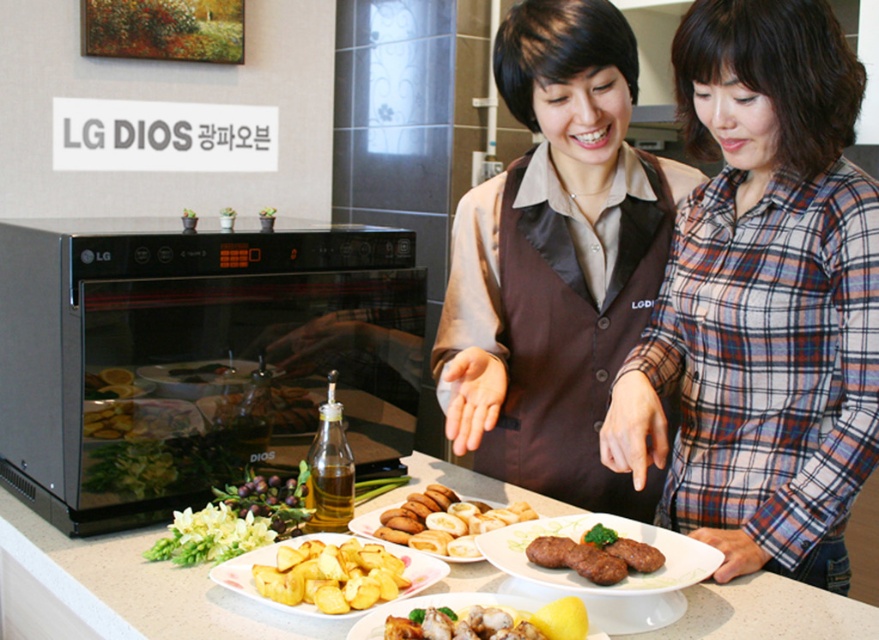
Question: Is matte brown plate at center bigger than shiny black plate at center?

Choices:
 (A) no
 (B) yes

Answer: (B)

Question: Which of these objects is positioned farthest from the brown fabric vest at center?

Choices:
 (A) black glass microwave at left
 (B) golden crispy chicken at center
 (C) translucent glass bottle at center
 (D) matte brown plate at center

Answer: (C)

Question: Can you confirm if brown matte meatballs at center is positioned below shiny black plate at center?

Choices:
 (A) yes
 (B) no

Answer: (A)

Question: Which object is farther from the camera taking this photo?

Choices:
 (A) brown matte meatballs at center
 (B) matte brown plate at center

Answer: (A)

Question: Estimate the real-world distances between objects in this image. Which object is closer to the translucent glass bottle at center?

Choices:
 (A) matte brown plate at center
 (B) white glossy plate at center

Answer: (A)

Question: Does brown satin apron at center appear under matte brown plate at center?

Choices:
 (A) yes
 (B) no

Answer: (B)